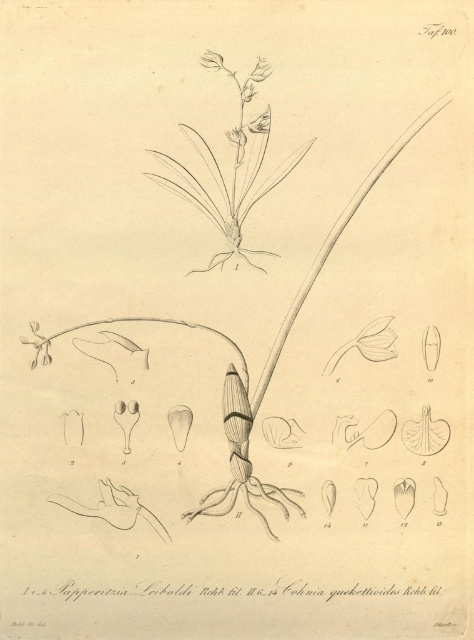
Question: Which of the following is the farthest from the observer?

Choices:
 (A) gray sketch orchid at center
 (B) matte white flower at lower left
 (C) matte white petal at center
 (D) matte white flower at upper center

Answer: (C)

Question: Is gray sketch orchid at center to the left of matte white flower at upper center from the viewer's perspective?

Choices:
 (A) no
 (B) yes

Answer: (B)

Question: Is matte white petal at center wider than matte white flower at upper center?

Choices:
 (A) yes
 (B) no

Answer: (A)

Question: Can you confirm if gray sketch orchid at center is smaller than matte white flower at upper center?

Choices:
 (A) no
 (B) yes

Answer: (A)

Question: Which point is farther to the camera?

Choices:
 (A) matte white petal at center
 (B) matte white flower at upper center

Answer: (A)

Question: Which of the following is the closest to the observer?

Choices:
 (A) matte white flower at lower left
 (B) matte white flower at upper center
 (C) matte white petal at center

Answer: (B)